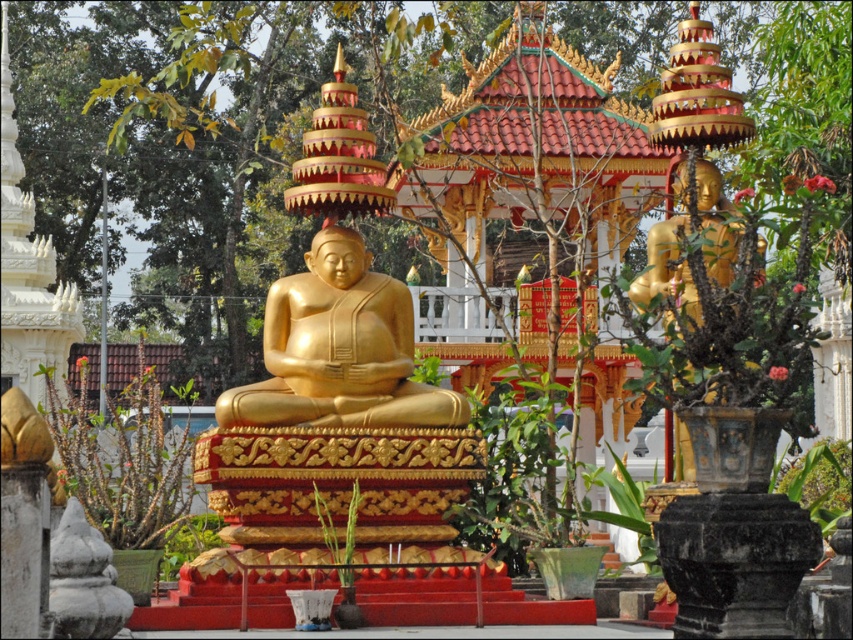
Question: Can you confirm if gold polished statue at center is positioned to the right of gold polished statue at right?

Choices:
 (A) yes
 (B) no

Answer: (B)

Question: Which point appears farthest from the camera in this image?

Choices:
 (A) (695, 298)
 (B) (277, 333)

Answer: (B)

Question: Can you confirm if gold polished statue at center is positioned above gold polished statue at right?

Choices:
 (A) no
 (B) yes

Answer: (A)

Question: Which point is closer to the camera taking this photo?

Choices:
 (A) (724, 211)
 (B) (363, 369)

Answer: (B)

Question: Which point appears closest to the camera in this image?

Choices:
 (A) (646, 291)
 (B) (334, 336)

Answer: (B)

Question: Does gold polished statue at center appear over gold polished statue at right?

Choices:
 (A) yes
 (B) no

Answer: (B)